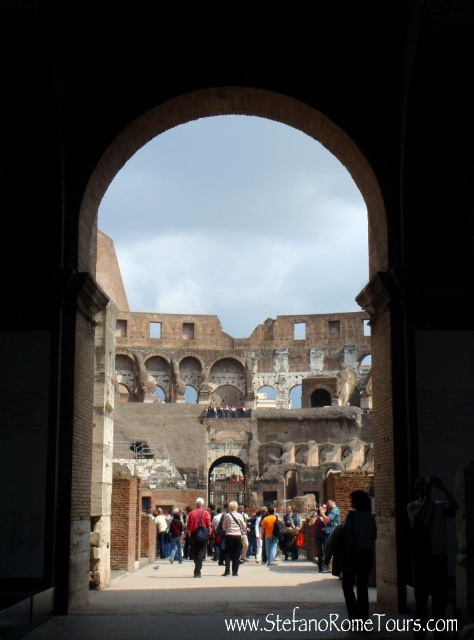
Question: Which of the following is the closest to the observer?

Choices:
 (A) orange cotton shirt at center
 (B) denim jacket at center

Answer: (B)

Question: Which point is farther to the camera?

Choices:
 (A) orange cotton shirt at center
 (B) dark blue fabric backpack at center
 (C) denim jacket at center

Answer: (A)

Question: Does dark blue fabric backpack at center lie behind orange cotton shirt at center?

Choices:
 (A) no
 (B) yes

Answer: (A)

Question: Based on their relative distances, which object is farther from the denim jacket at center?

Choices:
 (A) dark blue fabric backpack at center
 (B) red fabric backpack at center
 (C) orange cotton shirt at center

Answer: (A)

Question: Can you confirm if red fabric backpack at center is positioned above orange cotton shirt at center?

Choices:
 (A) yes
 (B) no

Answer: (B)

Question: Is red fabric backpack at center thinner than orange cotton shirt at center?

Choices:
 (A) yes
 (B) no

Answer: (B)